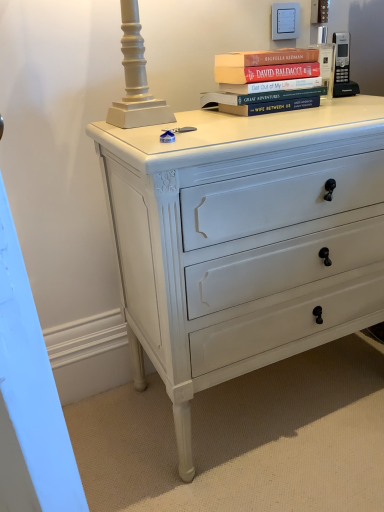
Question: Looking at their shapes, would you say black plastic phone at upper right is wider or thinner than white painted wood chest of drawers at center?

Choices:
 (A) wide
 (B) thin

Answer: (B)

Question: In terms of height, does black plastic phone at upper right look taller or shorter compared to white painted wood chest of drawers at center?

Choices:
 (A) tall
 (B) short

Answer: (B)

Question: Estimate the real-world distances between objects in this image. Which object is closer to the white painted wood chest of drawers at center?

Choices:
 (A) black plastic phone at upper right
 (B) hardcover books at upper center

Answer: (B)

Question: Estimate the real-world distances between objects in this image. Which object is farther from the black plastic phone at upper right?

Choices:
 (A) white painted wood chest of drawers at center
 (B) hardcover books at upper center

Answer: (A)